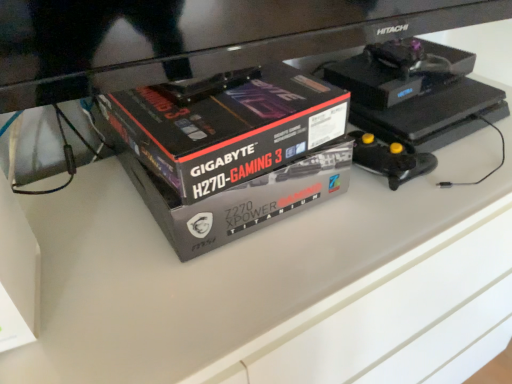
Question: Looking at their shapes, would you say matte black box at lower left, which is the first box from left to right, is wider or thinner than black glossy box at center, the 1th box when ordered from right to left?

Choices:
 (A) thin
 (B) wide

Answer: (A)

Question: Is point (14, 241) closer or farther from the camera than point (252, 102)?

Choices:
 (A) farther
 (B) closer

Answer: (B)

Question: Do you think matte black box at lower left, which is the first box from left to right, is within black glossy box at center, which is the 2th box in left-to-right order, or outside of it?

Choices:
 (A) outside
 (B) inside

Answer: (A)

Question: From a real-world perspective, is black glossy box at center, the 1th box when ordered from right to left, positioned above or below matte black box at lower left, which is the first box from left to right?

Choices:
 (A) above
 (B) below

Answer: (A)

Question: Choose the correct answer: Is black glossy box at center, which is the 2th box in left-to-right order, inside matte black box at lower left, which is the first box from left to right, or outside it?

Choices:
 (A) outside
 (B) inside

Answer: (A)

Question: Considering the positions of black glossy box at center, which is the 2th box in left-to-right order, and matte black box at lower left, which is the first box from left to right, in the image, is black glossy box at center, which is the 2th box in left-to-right order, wider or thinner than matte black box at lower left, which is the first box from left to right,?

Choices:
 (A) wide
 (B) thin

Answer: (A)

Question: From the image's perspective, relative to matte black box at lower left, which is the first box from left to right, is black glossy box at center, which is the 2th box in left-to-right order, above or below?

Choices:
 (A) above
 (B) below

Answer: (A)